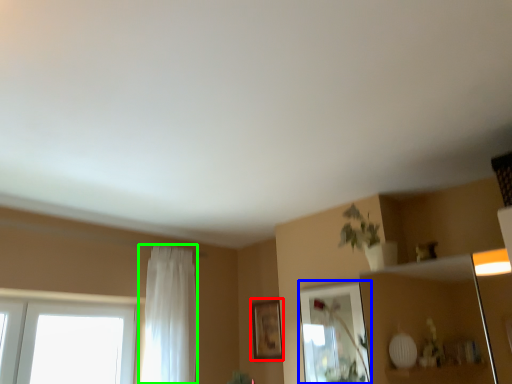
Question: Based on their relative distances, which object is farther from picture frame (highlighted by a red box)? Choose from mirror (highlighted by a blue box) and curtain (highlighted by a green box).

Choices:
 (A) mirror
 (B) curtain

Answer: (B)